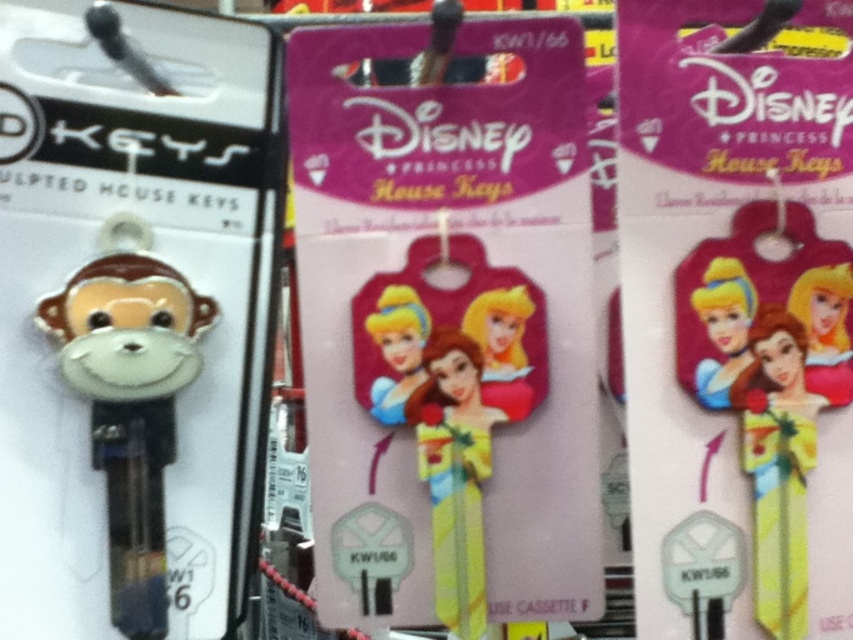
Question: Is yellow fabric doll at center positioned at the back of glossy plastic cinderella at center?

Choices:
 (A) no
 (B) yes

Answer: (B)

Question: Can you confirm if yellow fabric doll at center is positioned to the right of black plastic hook at upper left?

Choices:
 (A) no
 (B) yes

Answer: (B)

Question: Among these objects, which one is farthest from the camera?

Choices:
 (A) matte black keychain monkey at left
 (B) glossy plastic cinderella at center

Answer: (A)

Question: Which object appears farthest from the camera in this image?

Choices:
 (A) black plastic hook at upper left
 (B) matte black keychain monkey at left

Answer: (B)

Question: Estimate the real-world distances between objects in this image. Which object is closer to the yellow matte doll at center?

Choices:
 (A) glossy plastic princess at center
 (B) yellow fabric doll at center

Answer: (B)

Question: Is yellow matte doll at center to the right of black plastic hook at upper left from the viewer's perspective?

Choices:
 (A) no
 (B) yes

Answer: (B)